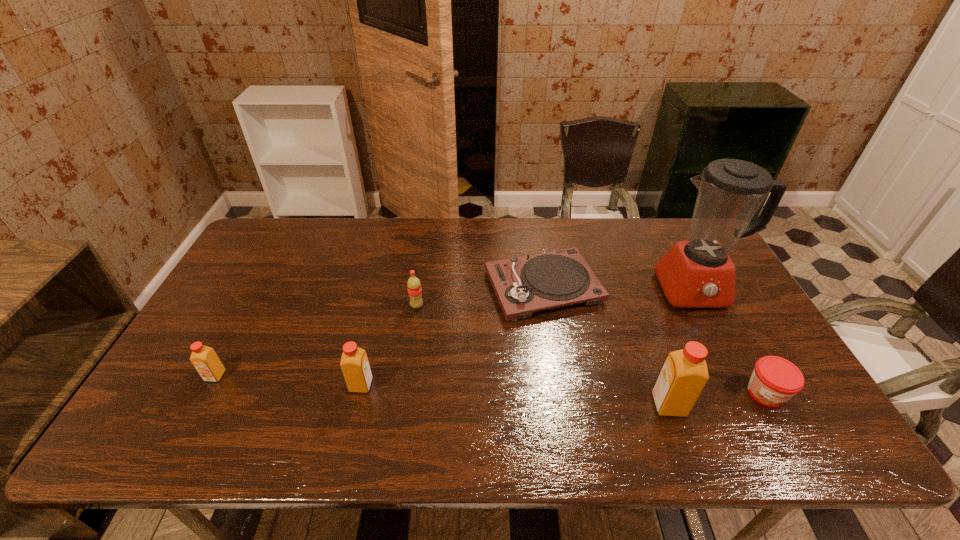
To ensure equal spacing by inserting another orange_juice among them, please point out a vacant spot for this new orange_juice. Please provide its 2D coordinates. Your answer should be formatted as a tuple, i.e. [(x, y)], where the tuple contains the x and y coordinates of a point satisfying the conditions above.

[(512, 395)]